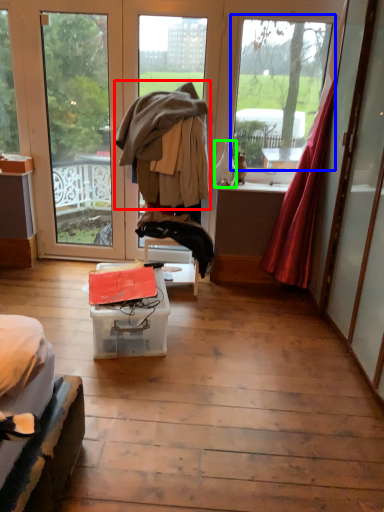
Question: Estimate the real-world distances between objects in this image. Which object is farther from jacket (highlighted by a red box), window (highlighted by a blue box) or bottle (highlighted by a green box)?

Choices:
 (A) window
 (B) bottle

Answer: (A)